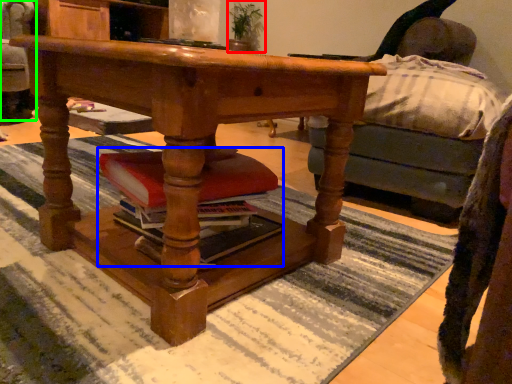
Question: Which object is the closest to the houseplant (highlighted by a red box)? Choose among these: book (highlighted by a blue box) or swivel chair (highlighted by a green box).

Choices:
 (A) book
 (B) swivel chair

Answer: (B)